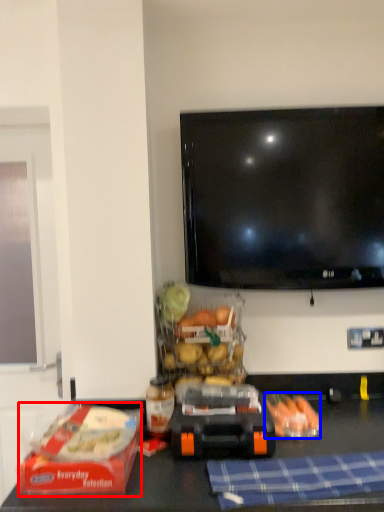
Question: Which point is closer to the camera, lunch box (highlighted by a red box) or food (highlighted by a blue box)?

Choices:
 (A) lunch box
 (B) food

Answer: (A)